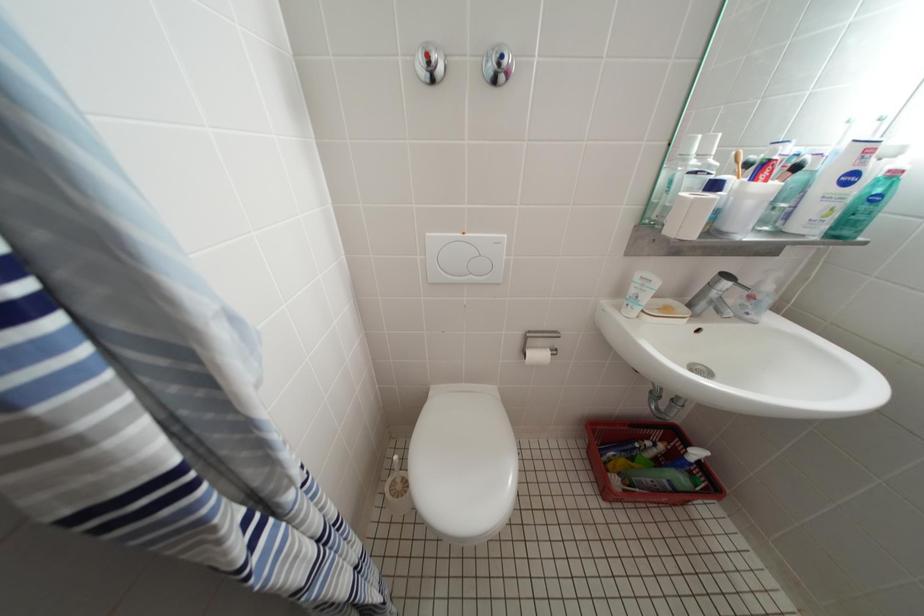
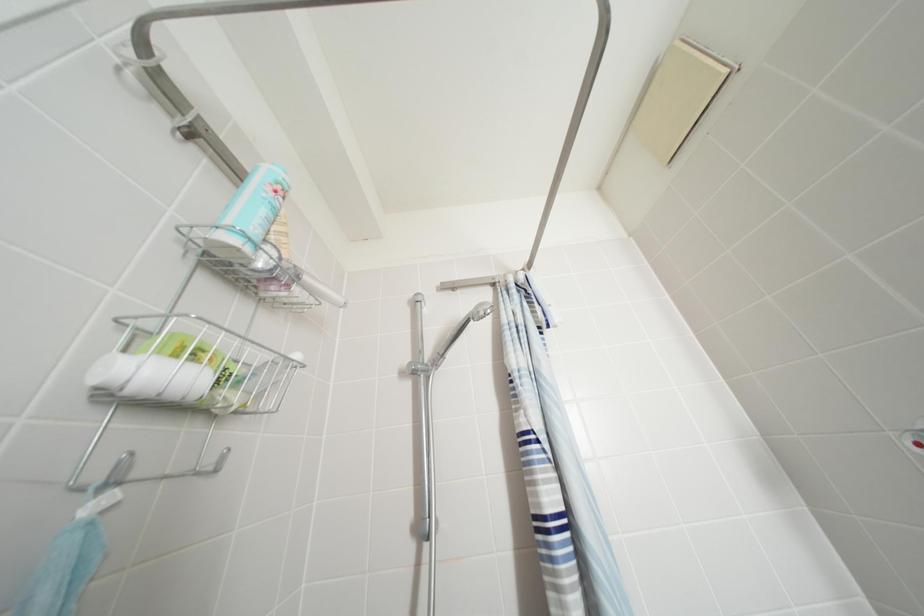
Based on the continuous images, in which direction is the camera rotating?

The rotation direction of the camera is left-up.